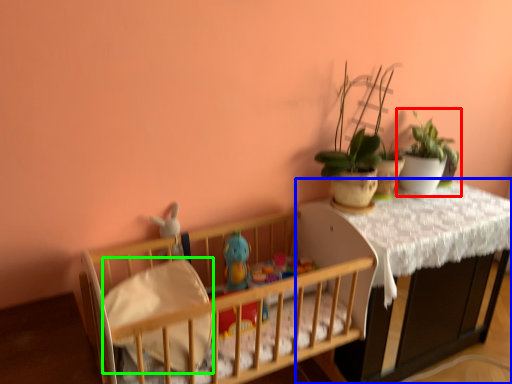
Question: Estimate the real-world distances between objects in this image. Which object is closer to houseplant (highlighted by a red box), table (highlighted by a blue box) or sheet (highlighted by a green box)?

Choices:
 (A) table
 (B) sheet

Answer: (A)